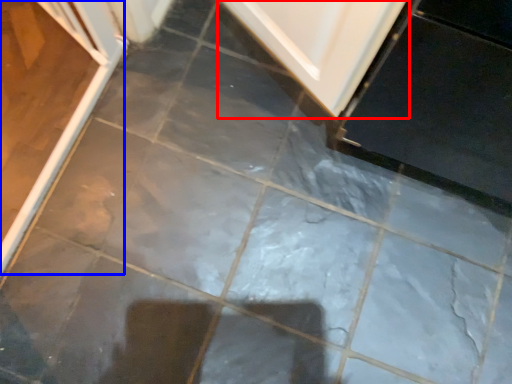
Question: Which object appears farthest to the camera in this image, door (highlighted by a red box) or screen door (highlighted by a blue box)?

Choices:
 (A) door
 (B) screen door

Answer: (A)